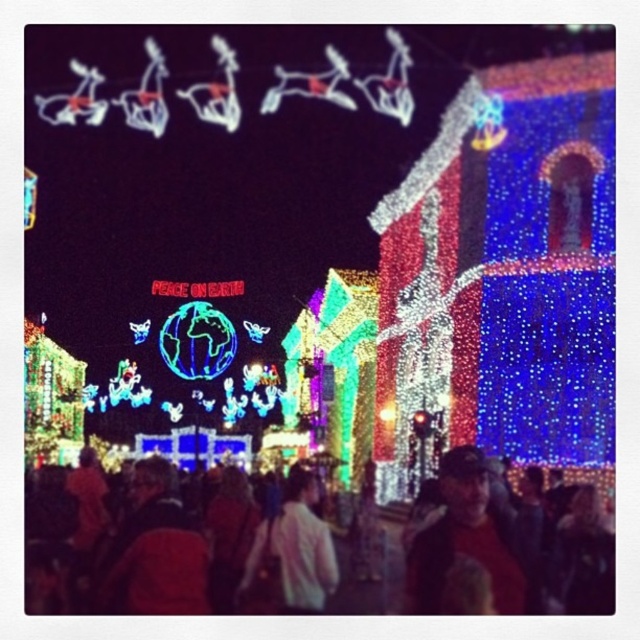
From the picture: Which is above, dark hair at lower right or white matte jacket at center?

Positioned higher is dark hair at lower right.

Which is in front, point (440, 483) or point (323, 584)?

Point (323, 584) is more forward.

Identify the location of dark hair at lower right. (464, 538).

Can you confirm if multicolored fabric crowd at center is positioned to the right of white matte jacket at center?

In fact, multicolored fabric crowd at center is to the left of white matte jacket at center.

What do you see at coordinates (508, 550) in the screenshot? This screenshot has width=640, height=640. I see `multicolored fabric crowd at center` at bounding box center [508, 550].

Is point (131, 548) in front of point (298, 570)?

That is True.

Identify the location of multicolored fabric crowd at center. This screenshot has height=640, width=640. (508, 550).

Describe the element at coordinates (508, 550) in the screenshot. I see `multicolored fabric crowd at center` at that location.

Who is positioned more to the left, multicolored fabric crowd at center or dark hair at lower right?

multicolored fabric crowd at center is more to the left.

The width and height of the screenshot is (640, 640). What are the coordinates of `multicolored fabric crowd at center` in the screenshot? It's located at (508, 550).